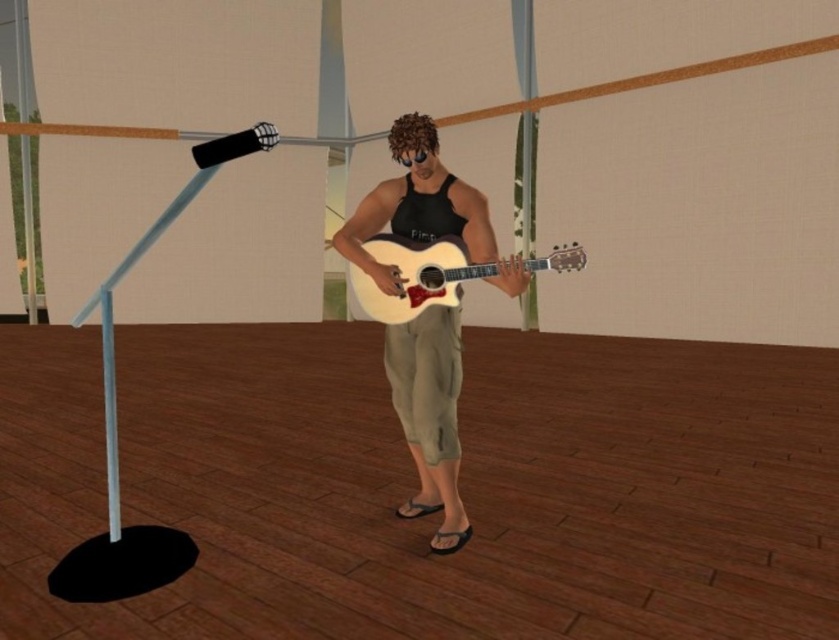
You are a photographer setting up for a photoshoot. You need to ensure that the matte black tank top at center and the light wood acoustic guitar at center are visible in the frame. Based on their positions, which object should be placed closer to the camera to ensure both are in focus?

The matte black tank top at center is positioned on the left side of the light wood acoustic guitar at center. To ensure both are in focus, the matte black tank top at center should be placed closer to the camera since it is already positioned to the side of the guitar, allowing for better depth of field adjustment.

You are a photographer setting up a shoot. You want to ensure that the matte black tank top at center is visible without being obscured by the light wood acoustic guitar at center. Based on the scene description, is this possible?

Yes, the matte black tank top at center is in front of the light wood acoustic guitar at center, so it will not be obscured by the guitar.

You are a fashion designer observing the scene. You need to determine which item is narrower between the matte black tank top at center and the light wood acoustic guitar at center. Which one is it?

The matte black tank top at center has a lesser width compared to the light wood acoustic guitar at center, so the matte black tank top at center is narrower.